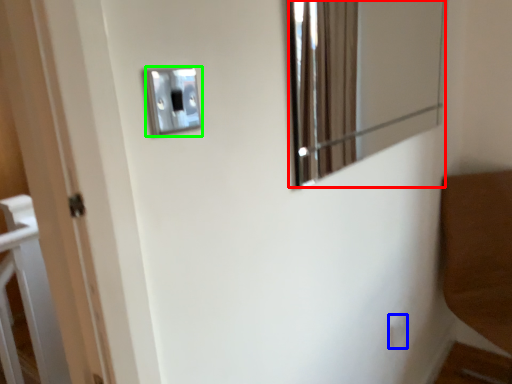
Question: Considering the real-world distances, which object is closest to mirror (highlighted by a red box)? light switch (highlighted by a blue box) or light switch (highlighted by a green box).

Choices:
 (A) light switch
 (B) light switch

Answer: (A)